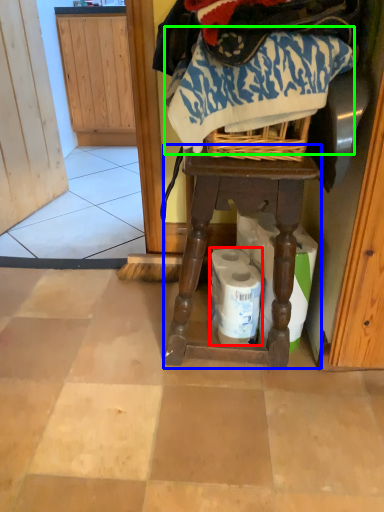
Question: Considering the real-world distances, which object is farthest from toilet paper (highlighted by a red box)? furniture (highlighted by a blue box) or clothing (highlighted by a green box)?

Choices:
 (A) furniture
 (B) clothing

Answer: (B)